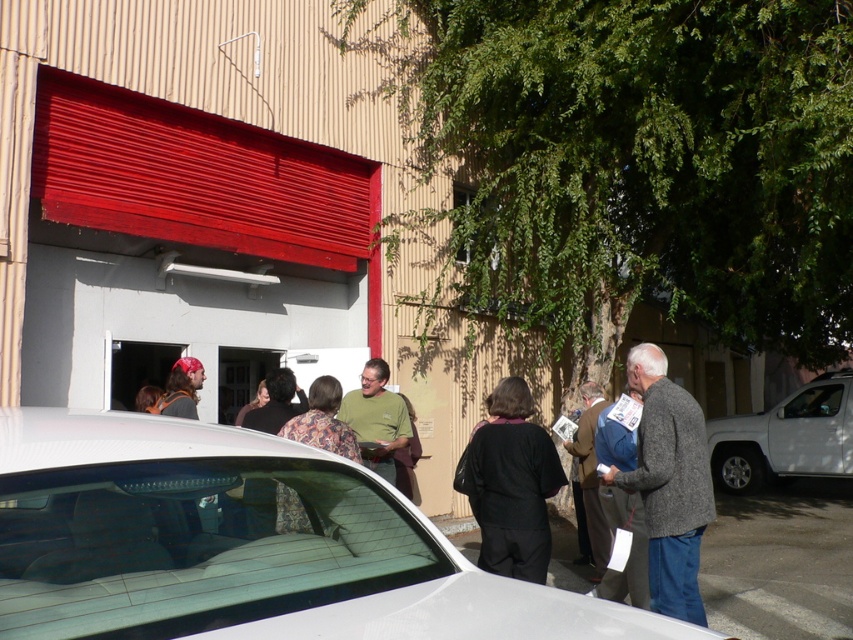
Based on the photo, does black matte coat at center have a smaller size compared to white matte truck at right?

Correct, black matte coat at center occupies less space than white matte truck at right.

Is black matte coat at center to the right of white matte truck at right from the viewer's perspective?

In fact, black matte coat at center is to the left of white matte truck at right.

Identify the location of black matte coat at center. Image resolution: width=853 pixels, height=640 pixels. coord(511,484).

Can you confirm if white glossy car at center is positioned to the left of brown leather jacket at center?

In fact, white glossy car at center is to the right of brown leather jacket at center.

Can you confirm if white glossy car at center is positioned above brown leather jacket at center?

No.

Does point (262, 513) come farther from viewer compared to point (144, 392)?

No, (262, 513) is closer to viewer.

At what (x,y) coordinates should I click in order to perform the action: click on white glossy car at center. Please return your answer as a coordinate pair (x, y). Image resolution: width=853 pixels, height=640 pixels. Looking at the image, I should click on (242, 545).

Between white matte truck at right and green matte shirt at center, which one is positioned lower?

Positioned lower is white matte truck at right.

Which is more to the left, white matte truck at right or green matte shirt at center?

From the viewer's perspective, green matte shirt at center appears more on the left side.

This screenshot has height=640, width=853. Identify the location of white matte truck at right. (786, 436).